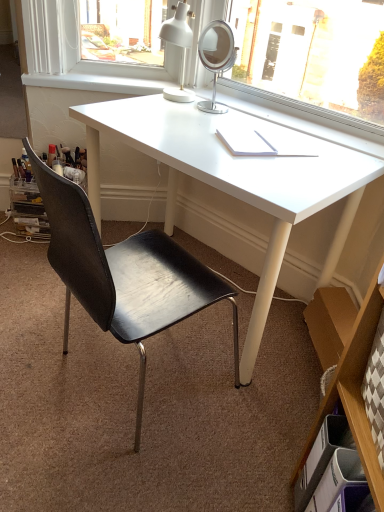
Find the location of a particular element. empty space that is ontop of white glossy desk at center (from a real-world perspective) is located at coordinates (226, 140).